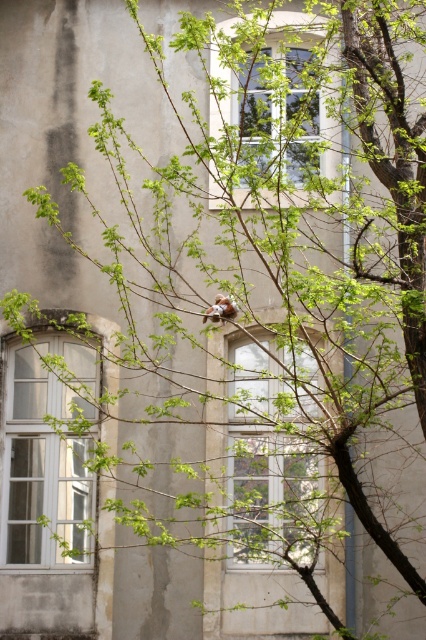
You are standing in front of the tree and want to look through the white glass window at lower left located at point (46, 456). Can you see the window clearly through the branches?

The white glass window at lower left located at point (46, 456) is obstructed by the tree branches, so you cannot see it clearly.